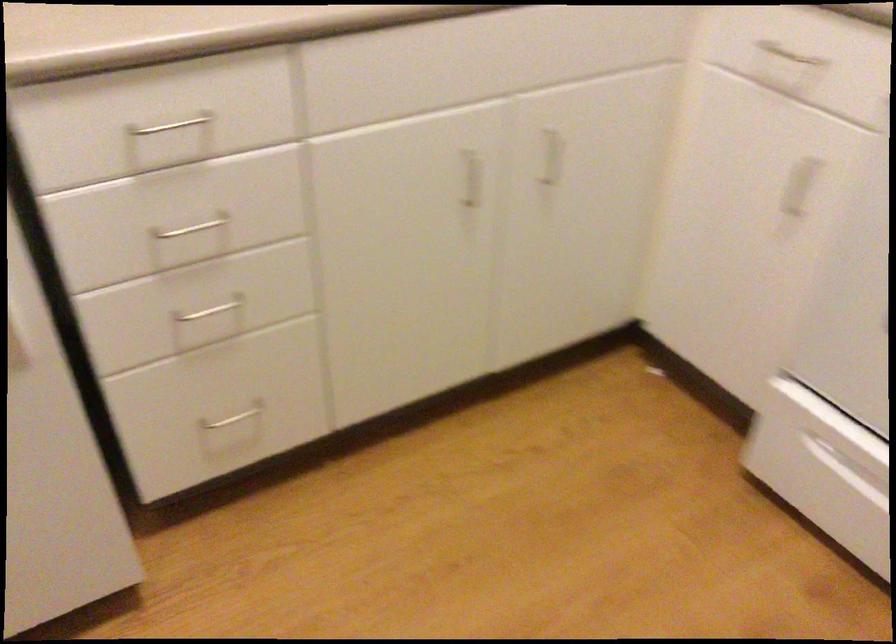
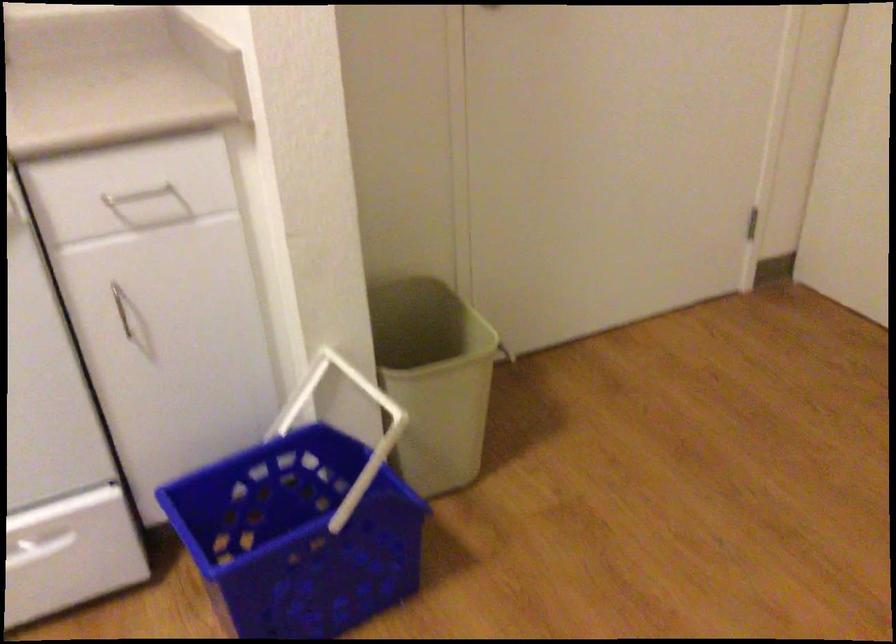
First-person continuous shooting, in which direction is the camera rotating?

The rotation direction of the camera is right-down.